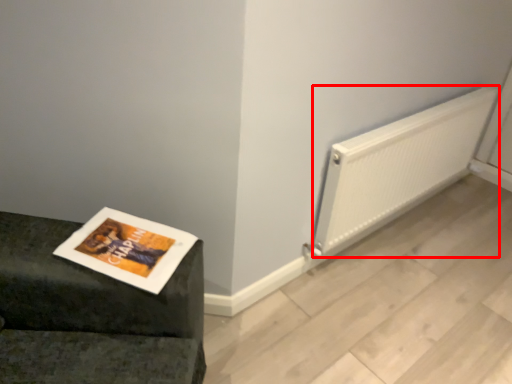
Question: From the image's perspective, where is radiator (annotated by the red box) located relative to magazine?

Choices:
 (A) below
 (B) above

Answer: (B)